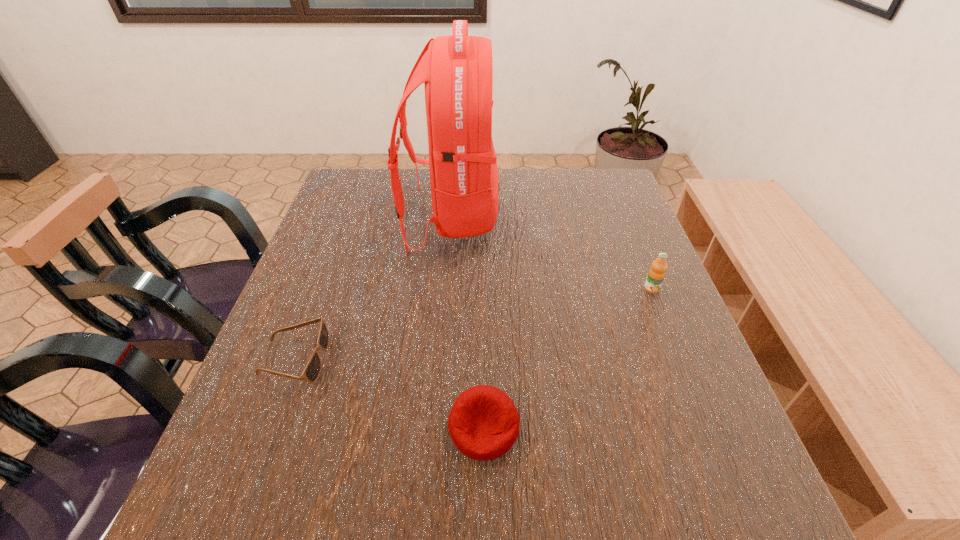
Locate an element on the screen. free spot between the leftmost object and the backpack is located at coordinates (372, 289).

Locate an element on the screen. This screenshot has width=960, height=540. empty space that is in between the nearest object and the backpack is located at coordinates (468, 323).

Locate an element on the screen. The width and height of the screenshot is (960, 540). unoccupied area between the orange juice and the second nearest object is located at coordinates (473, 324).

Locate an element on the screen. The height and width of the screenshot is (540, 960). free space between the rightmost object and the farthest object is located at coordinates (551, 254).

What are the coordinates of `free space between the backpack and the second nearest object` in the screenshot? It's located at (372, 289).

Where is `free spot between the second nearest object and the second tallest object`? free spot between the second nearest object and the second tallest object is located at coordinates (473, 324).

The width and height of the screenshot is (960, 540). In order to click on free space between the third shortest object and the farthest object in this screenshot , I will do `click(551, 254)`.

Find the location of a particular element. free area in between the sunglasses and the backpack is located at coordinates (372, 289).

Locate an element on the screen. This screenshot has height=540, width=960. unoccupied position between the rightmost object and the beanbag is located at coordinates (567, 358).

This screenshot has width=960, height=540. Identify the location of free space between the orange juice and the backpack. (551, 254).